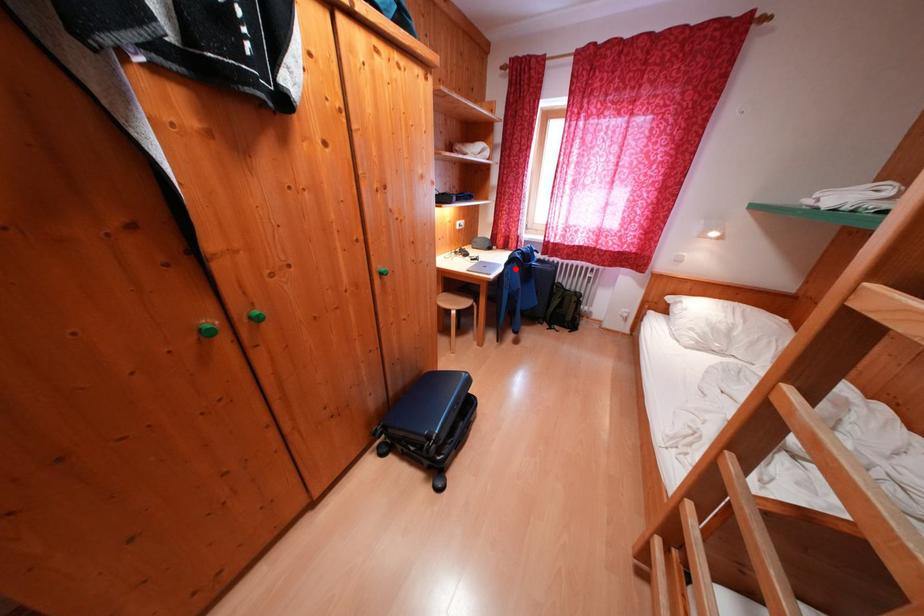
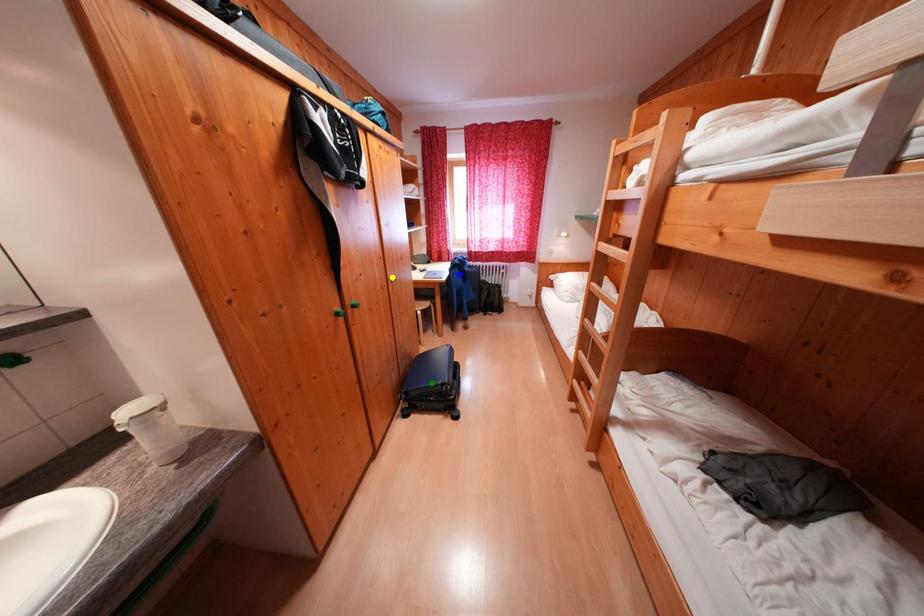
Question: I am providing you with two images of the same scene from different viewpoints. A red point is marked on the first image. You are given multiple points on the second image. Can you choose the point in image 2 that corresponds to the point in image 1?

Choices:
 (A) yellow point
 (B) blue point
 (C) green point

Answer: (B)